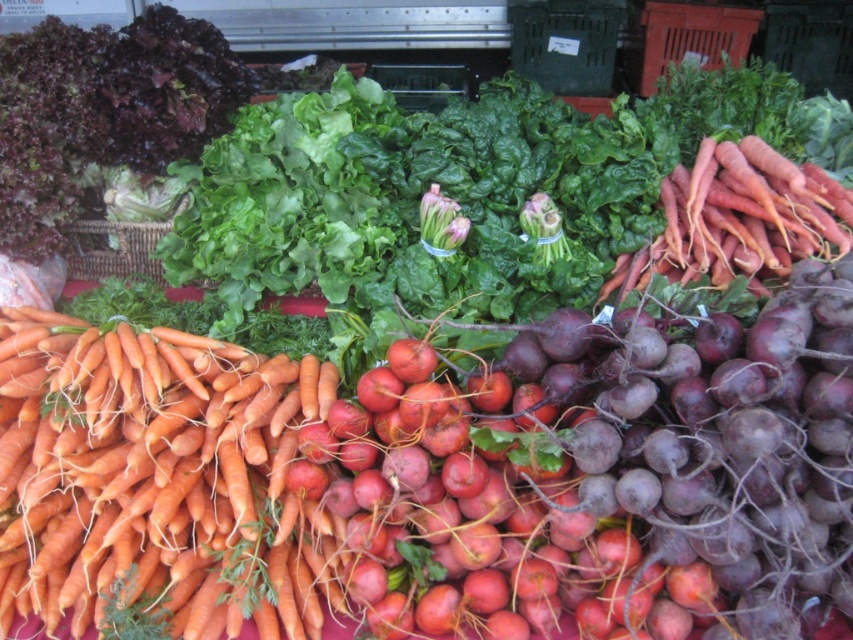
Based on the photo, how far apart are orange matte carrots at left and orange matte carrots at upper right?

They are 1.15 meters apart.

Is orange matte carrots at left to the right of orange matte carrots at upper right from the viewer's perspective?

In fact, orange matte carrots at left is to the left of orange matte carrots at upper right.

Locate an element on the screen. orange matte carrots at left is located at coordinates (155, 465).

Where is `orange matte carrots at left`? The width and height of the screenshot is (853, 640). orange matte carrots at left is located at coordinates (155, 465).